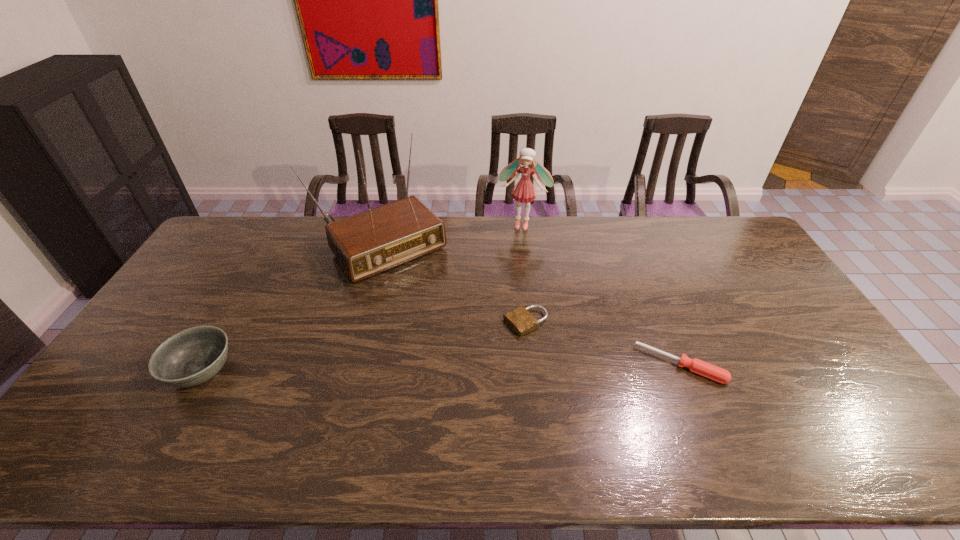
What are the coordinates of `doll present at the far edge` in the screenshot? It's located at (524, 191).

Image resolution: width=960 pixels, height=540 pixels. Identify the location of object that is at the near edge. (191, 357).

I want to click on object located at the left edge, so click(191, 357).

I want to click on object situated at the near left corner, so click(x=191, y=357).

Find the location of `vacant space at the far edge of the desktop`. vacant space at the far edge of the desktop is located at coordinates (671, 249).

Locate an element on the screen. The width and height of the screenshot is (960, 540). free space at the near edge is located at coordinates (716, 407).

Where is `vacant space at the left edge of the desktop`? vacant space at the left edge of the desktop is located at coordinates (125, 373).

Find the location of a particular element. The width and height of the screenshot is (960, 540). free point at the right edge is located at coordinates (740, 268).

In the image, there is a desktop. At what (x,y) coordinates should I click in order to perform the action: click on vacant space at the far left corner. Please return your answer as a coordinate pair (x, y). The width and height of the screenshot is (960, 540). Looking at the image, I should click on (238, 234).

Where is `vacant space at the far right corner of the desktop`? This screenshot has height=540, width=960. vacant space at the far right corner of the desktop is located at coordinates (733, 234).